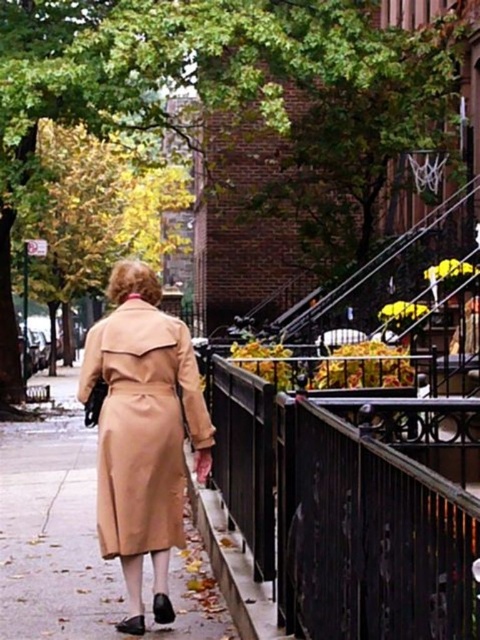
Question: Is black wrought iron railing at center thinner than beige leather trench coat at center?

Choices:
 (A) yes
 (B) no

Answer: (B)

Question: Is black wrought iron railing at center wider than beige leather trench coat at center?

Choices:
 (A) yes
 (B) no

Answer: (A)

Question: Which of the following is the closest to the observer?

Choices:
 (A) beige leather trench coat at center
 (B) black wrought iron railing at center

Answer: (B)

Question: Which point is closer to the camera?

Choices:
 (A) (180, 468)
 (B) (459, 636)

Answer: (B)

Question: Is black wrought iron railing at center to the right of beige leather trench coat at center from the viewer's perspective?

Choices:
 (A) no
 (B) yes

Answer: (B)

Question: Which of the following is the farthest from the observer?

Choices:
 (A) (124, 337)
 (B) (230, 486)

Answer: (B)